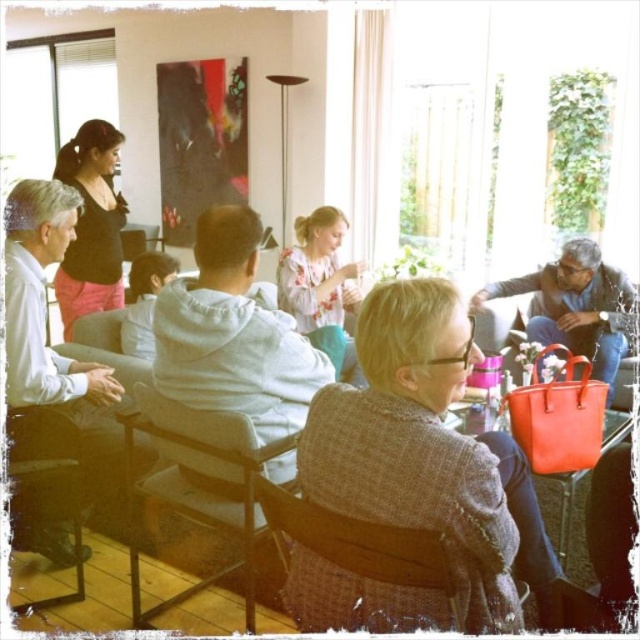
Describe the element at coordinates (49, 484) in the screenshot. I see `wooden chair at lower left` at that location.

The height and width of the screenshot is (640, 640). What are the coordinates of `wooden chair at lower left` in the screenshot? It's located at (49, 484).

Locate an element on the screen. The width and height of the screenshot is (640, 640). wooden chair at lower left is located at coordinates (49, 484).

Does point (240, 490) come farther from viewer compared to point (38, 544)?

No, it is in front of (38, 544).

Is wooden chair at center wider than wooden chair at lower left?

Correct, the width of wooden chair at center exceeds that of wooden chair at lower left.

At what (x,y) coordinates should I click in order to perform the action: click on wooden chair at center. Please return your answer as a coordinate pair (x, y). This screenshot has height=640, width=640. Looking at the image, I should click on (196, 484).

From the picture: How far apart are wooden chair at center and matte black top at upper left?

A distance of 4.87 feet exists between wooden chair at center and matte black top at upper left.

Between point (180, 483) and point (81, 308), which one is positioned in front?

Point (180, 483)

I want to click on wooden chair at center, so click(x=196, y=484).